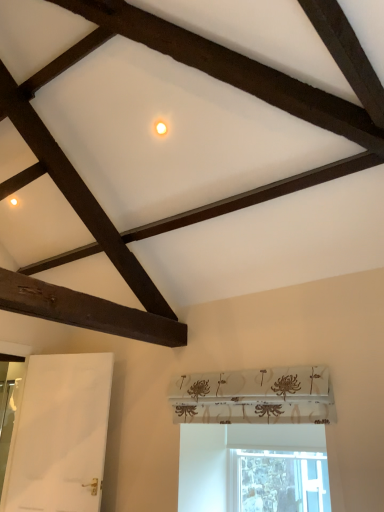
Question: Choose the correct answer: Is transparent glass window at lower center inside white matte door at lower left or outside it?

Choices:
 (A) outside
 (B) inside

Answer: (A)

Question: From a real-world perspective, is transparent glass window at lower center physically located above or below white matte door at lower left?

Choices:
 (A) below
 (B) above

Answer: (A)

Question: Considering the relative positions of transparent glass window at lower center and white matte door at lower left in the image provided, is transparent glass window at lower center to the left or to the right of white matte door at lower left?

Choices:
 (A) right
 (B) left

Answer: (A)

Question: From a real-world perspective, is white matte door at lower left physically located above or below transparent glass window at lower center?

Choices:
 (A) above
 (B) below

Answer: (A)

Question: Choose the correct answer: Is white matte door at lower left inside transparent glass window at lower center or outside it?

Choices:
 (A) inside
 (B) outside

Answer: (B)

Question: Is white matte door at lower left in front of or behind transparent glass window at lower center in the image?

Choices:
 (A) behind
 (B) front

Answer: (A)

Question: Considering the positions of white matte door at lower left and transparent glass window at lower center in the image, is white matte door at lower left taller or shorter than transparent glass window at lower center?

Choices:
 (A) short
 (B) tall

Answer: (B)